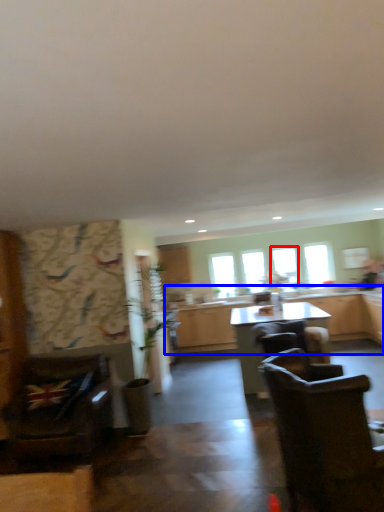
Question: Which object is closer to the camera taking this photo, window (highlighted by a red box) or cabinetry (highlighted by a blue box)?

Choices:
 (A) window
 (B) cabinetry

Answer: (B)